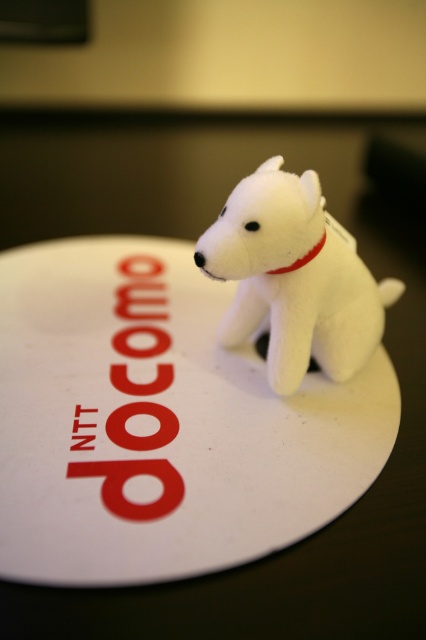
Question: Does white plush dog at center appear on the left side of white fabric neckband at center?

Choices:
 (A) no
 (B) yes

Answer: (A)

Question: Does white paper plate at center have a lesser width compared to white fabric neckband at center?

Choices:
 (A) yes
 (B) no

Answer: (B)

Question: Which point is closer to the camera?

Choices:
 (A) white plush dog at center
 (B) white fabric neckband at center

Answer: (A)

Question: Which object is the farthest from the white paper plate at center?

Choices:
 (A) white plush dog at center
 (B) white fabric neckband at center

Answer: (B)

Question: Does white paper plate at center come behind white plush dog at center?

Choices:
 (A) no
 (B) yes

Answer: (A)

Question: Which point appears farthest from the camera in this image?

Choices:
 (A) click(17, 310)
 (B) click(226, 316)
 (C) click(305, 256)

Answer: (A)